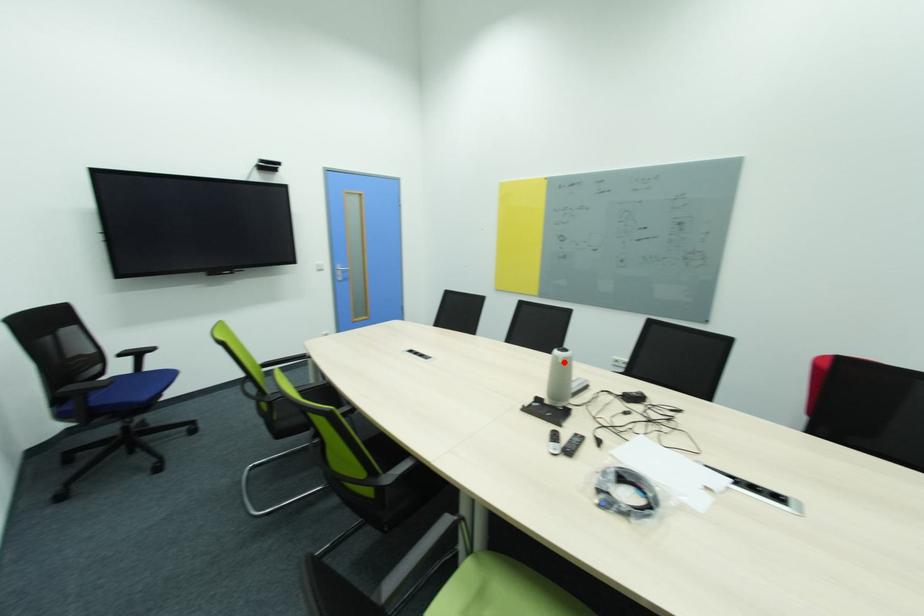
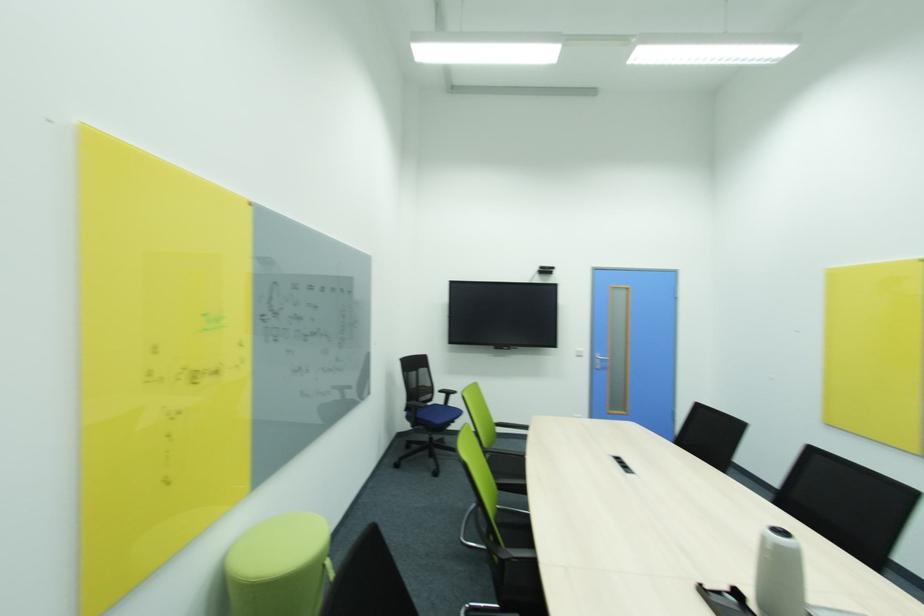
Question: A red point is marked in image1. In image2, is the corresponding 3D point closer to the camera or farther? Reply with the corresponding letter.

Choices:
 (A) The corresponding 3D point is closer.
 (B) The corresponding 3D point is farther.

Answer: (A)